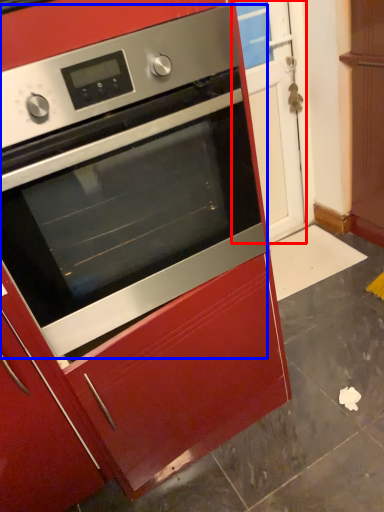
Question: Among these objects, which one is farthest to the camera, glass door (highlighted by a red box) or oven (highlighted by a blue box)?

Choices:
 (A) glass door
 (B) oven

Answer: (A)